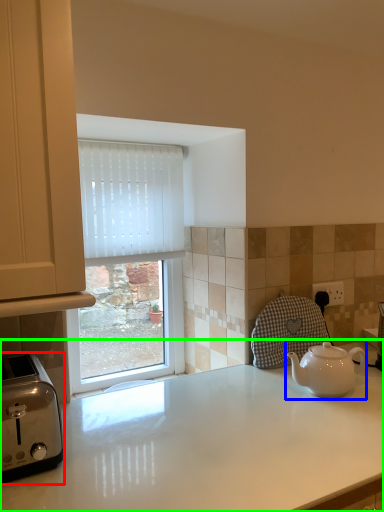
Question: Which object is positioned closest to toaster (highlighted by a red box)? Select from kettle (highlighted by a blue box) and countertop (highlighted by a green box).

Choices:
 (A) kettle
 (B) countertop

Answer: (B)